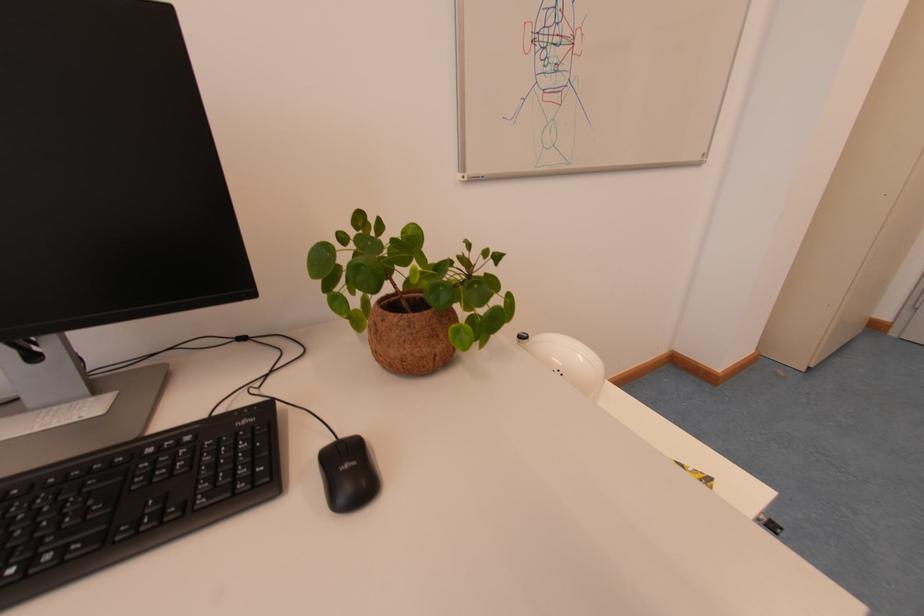
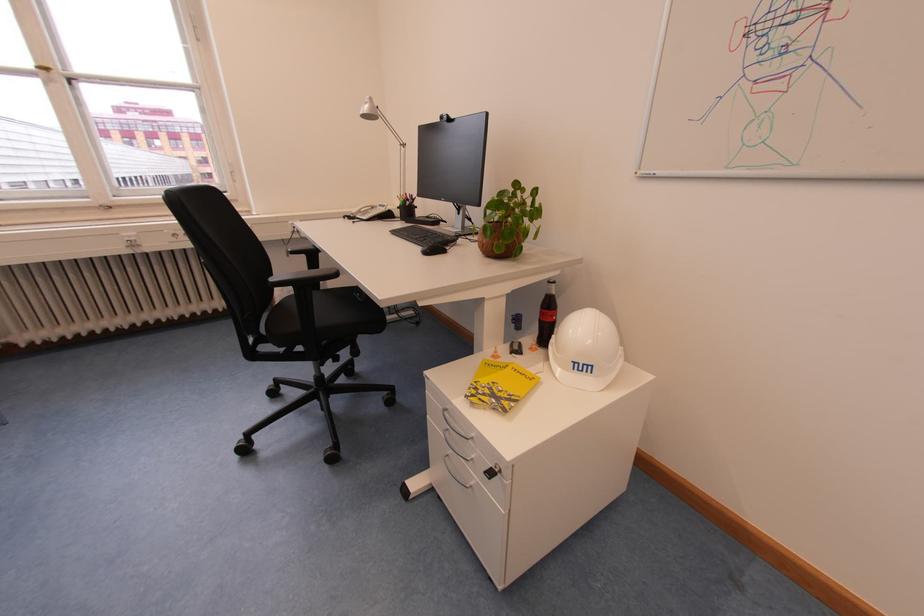
Locate, in the second image, the point that corresponds to [367,220] in the first image.

(524, 187)